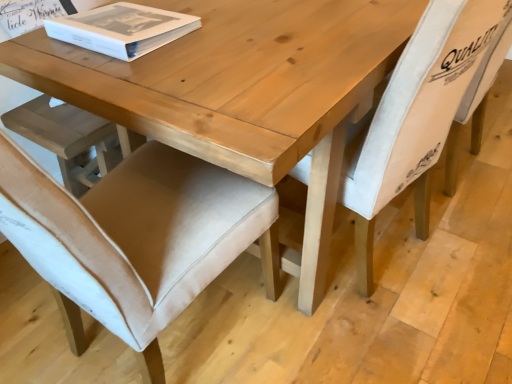
Question: Is beige fabric chair at lower left, the second chair viewed from the right, positioned with its back to light beige fabric chair at center, which is the second chair from left to right?

Choices:
 (A) yes
 (B) no

Answer: (B)

Question: Is beige fabric chair at lower left, marked as the 1th chair in a left-to-right arrangement, to the left of light beige fabric chair at center, which is the second chair from left to right, from the viewer's perspective?

Choices:
 (A) no
 (B) yes

Answer: (B)

Question: Does beige fabric chair at lower left, the second chair viewed from the right, have a larger size compared to light beige fabric chair at center, which is the second chair from left to right?

Choices:
 (A) no
 (B) yes

Answer: (B)

Question: Is beige fabric chair at lower left, marked as the 1th chair in a left-to-right arrangement, shorter than light beige fabric chair at center, which is the second chair from left to right?

Choices:
 (A) no
 (B) yes

Answer: (A)

Question: Does beige fabric chair at lower left, marked as the 1th chair in a left-to-right arrangement, touch light beige fabric chair at center, which is the second chair from left to right?

Choices:
 (A) no
 (B) yes

Answer: (A)

Question: Is white paper book at upper left taller or shorter than beige fabric chair at lower left, marked as the 1th chair in a left-to-right arrangement?

Choices:
 (A) short
 (B) tall

Answer: (A)

Question: Is white paper book at upper left spatially inside beige fabric chair at lower left, marked as the 1th chair in a left-to-right arrangement, or outside of it?

Choices:
 (A) outside
 (B) inside

Answer: (A)

Question: Considering the positions of white paper book at upper left and beige fabric chair at lower left, marked as the 1th chair in a left-to-right arrangement, in the image, is white paper book at upper left bigger or smaller than beige fabric chair at lower left, marked as the 1th chair in a left-to-right arrangement,?

Choices:
 (A) big
 (B) small

Answer: (B)

Question: From the image's perspective, is white paper book at upper left located above or below beige fabric chair at lower left, marked as the 1th chair in a left-to-right arrangement?

Choices:
 (A) above
 (B) below

Answer: (A)

Question: Is beige fabric chair at lower left, marked as the 1th chair in a left-to-right arrangement, inside or outside of light beige fabric chair at center, the first chair in the right-to-left sequence?

Choices:
 (A) inside
 (B) outside

Answer: (B)

Question: Considering the positions of point (57, 253) and point (393, 99), is point (57, 253) closer or farther from the camera than point (393, 99)?

Choices:
 (A) farther
 (B) closer

Answer: (B)

Question: Considering the positions of beige fabric chair at lower left, the second chair viewed from the right, and light beige fabric chair at center, which is the second chair from left to right, in the image, is beige fabric chair at lower left, the second chair viewed from the right, wider or thinner than light beige fabric chair at center, which is the second chair from left to right,?

Choices:
 (A) thin
 (B) wide

Answer: (B)

Question: Considering the relative positions of beige fabric chair at lower left, marked as the 1th chair in a left-to-right arrangement, and light beige fabric chair at center, the first chair in the right-to-left sequence, in the image provided, is beige fabric chair at lower left, marked as the 1th chair in a left-to-right arrangement, to the left or to the right of light beige fabric chair at center, the first chair in the right-to-left sequence,?

Choices:
 (A) left
 (B) right

Answer: (A)

Question: Is point (343, 198) closer or farther from the camera than point (110, 34)?

Choices:
 (A) closer
 (B) farther

Answer: (B)

Question: Is light beige fabric chair at center, which is the second chair from left to right, inside the boundaries of white paper book at upper left, or outside?

Choices:
 (A) outside
 (B) inside

Answer: (A)